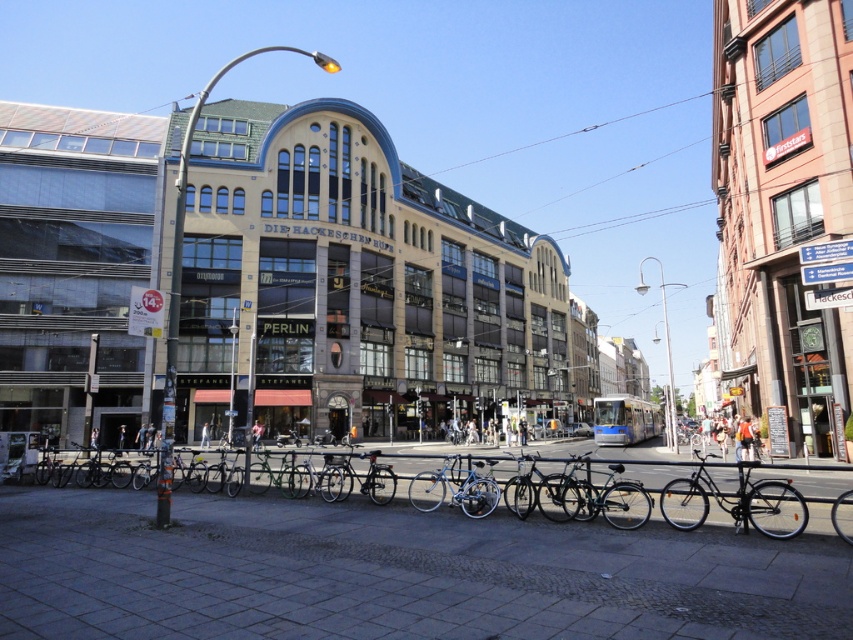
You are a tailor observing the pink fabric jacket at center and the white cotton shirt at center. Which garment has a larger width when laid flat?

The pink fabric jacket at center has a larger width than the white cotton shirt at center as stated in the description.

You are a delivery person standing at the entrance of Hackeschen Hof. You need to deliver a package to a person wearing either the pink fabric jacket at center or the white cotton shirt at center. The delivery zone is only 3 meters wide. Can you fit both recipients within the delivery zone at the same time?

The pink fabric jacket at center and white cotton shirt at center are 3.76 meters apart. Since the delivery zone is only 3 meters wide, they cannot both fit within the delivery zone at the same time.